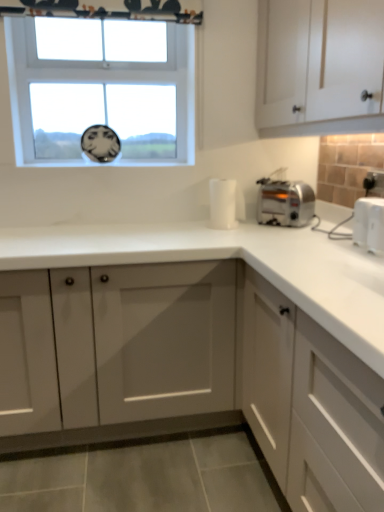
The width and height of the screenshot is (384, 512). I want to click on white plastic toaster at right, so click(x=369, y=224).

This screenshot has width=384, height=512. Describe the element at coordinates (285, 203) in the screenshot. I see `satin silver toaster at right` at that location.

How much space does white matte cabinet at upper right, marked as the 1th cabinetry in a top-to-bottom arrangement, occupy horizontally?

white matte cabinet at upper right, marked as the 1th cabinetry in a top-to-bottom arrangement, is 16.98 inches in width.

Where is `white matte cabinet at lower right, which is the 1th cabinetry from bottom to top`? This screenshot has height=512, width=384. white matte cabinet at lower right, which is the 1th cabinetry from bottom to top is located at coordinates (311, 406).

The height and width of the screenshot is (512, 384). What do you see at coordinates (101, 96) in the screenshot?
I see `clear glass window at upper center` at bounding box center [101, 96].

Find the location of a particular element. The image size is (384, 512). white plastic toaster at right is located at coordinates (369, 224).

At what (x,y) coordinates should I click in order to perform the action: click on appliance located underneath the clear glass window at upper center (from a real-world perspective). Please return your answer as a coordinate pair (x, y). Looking at the image, I should click on (369, 224).

Does point (382, 251) appear closer or farther from the camera than point (170, 115)?

Point (382, 251) is closer to the camera than point (170, 115).

From the image's perspective, is white plastic toaster at right above or below clear glass window at upper center?

white plastic toaster at right is below clear glass window at upper center.

Would you say clear glass window at upper center is part of white plastic toaster at right's contents?

That's incorrect, clear glass window at upper center is not inside white plastic toaster at right.

From a real-world perspective, count 1st cabinetrys upward from the white matte cabinet at lower right, the third cabinetry when ordered from top to bottom, and point to it. Please provide its 2D coordinates.

[(192, 370)]

From the image's perspective, which is below, white matte cabinet at center, which is the second cabinetry in bottom-to-top order, or white matte cabinet at lower right, the third cabinetry when ordered from top to bottom?

From the image's view, white matte cabinet at lower right, the third cabinetry when ordered from top to bottom, is below.

Would you consider white matte cabinet at center, which is the second cabinetry in bottom-to-top order, to be distant from white matte cabinet at lower right, the third cabinetry when ordered from top to bottom?

white matte cabinet at center, which is the second cabinetry in bottom-to-top order, is near white matte cabinet at lower right, the third cabinetry when ordered from top to bottom, not far away.

How different are the orientations of white matte cabinet at center, which is counted as the second cabinetry, starting from the top, and white matte cabinet at lower right, which is the 1th cabinetry from bottom to top, in degrees?

89.9 degrees separate the facing orientations of white matte cabinet at center, which is counted as the second cabinetry, starting from the top, and white matte cabinet at lower right, which is the 1th cabinetry from bottom to top.

What's the angular difference between clear glass window at upper center and white plastic toaster at right's facing directions?

88.6 degrees.

Considering the sizes of clear glass window at upper center and white plastic toaster at right in the image, is clear glass window at upper center taller or shorter than white plastic toaster at right?

Considering their sizes, clear glass window at upper center has more height than white plastic toaster at right.

Considering their positions, is clear glass window at upper center located in front of or behind white plastic toaster at right?

Visually, clear glass window at upper center is located behind white plastic toaster at right.

From the image's perspective, which is below, clear glass window at upper center or white plastic toaster at right?

white plastic toaster at right appears lower in the image.

In the image, is white matte cabinet at upper right, marked as the 1th cabinetry in a top-to-bottom arrangement, positioned in front of or behind white matte cabinet at center, which is the second cabinetry in bottom-to-top order?

In the image, white matte cabinet at upper right, marked as the 1th cabinetry in a top-to-bottom arrangement, appears in front of white matte cabinet at center, which is the second cabinetry in bottom-to-top order.

Image resolution: width=384 pixels, height=512 pixels. There is a white matte cabinet at upper right, the 3th cabinetry in the bottom-to-top sequence. In order to click on the 1st cabinetry below it (from the image's perspective) in this screenshot , I will do `click(192, 370)`.

From a real-world perspective, who is located lower, white matte cabinet at upper right, the 3th cabinetry in the bottom-to-top sequence, or white matte cabinet at center, which is counted as the second cabinetry, starting from the top?

white matte cabinet at center, which is counted as the second cabinetry, starting from the top, from a real-world perspective.

Which object is positioned more to the right, white matte cabinet at upper right, marked as the 1th cabinetry in a top-to-bottom arrangement, or white matte cabinet at center, which is counted as the second cabinetry, starting from the top?

Positioned to the right is white matte cabinet at upper right, marked as the 1th cabinetry in a top-to-bottom arrangement.

Does satin silver toaster at right turn towards white plastic toaster at right?

No, satin silver toaster at right is not turned towards white plastic toaster at right.

Looking at their sizes, would you say satin silver toaster at right is wider or thinner than white plastic toaster at right?

In the image, satin silver toaster at right appears to be more narrow than white plastic toaster at right.

Looking at the image, does satin silver toaster at right seem bigger or smaller compared to white plastic toaster at right?

Considering their sizes, satin silver toaster at right takes up more space than white plastic toaster at right.

From the picture: Can you see white plastic toaster at right touching white matte cabinet at upper right, marked as the 1th cabinetry in a top-to-bottom arrangement?

There is a gap between white plastic toaster at right and white matte cabinet at upper right, marked as the 1th cabinetry in a top-to-bottom arrangement.

From the image's perspective, would you say white plastic toaster at right is positioned over white matte cabinet at upper right, the 3th cabinetry in the bottom-to-top sequence?

No, from the image's perspective, white plastic toaster at right is not above white matte cabinet at upper right, the 3th cabinetry in the bottom-to-top sequence.

Would you say white plastic toaster at right contains white matte cabinet at upper right, marked as the 1th cabinetry in a top-to-bottom arrangement?

No, white plastic toaster at right does not contain white matte cabinet at upper right, marked as the 1th cabinetry in a top-to-bottom arrangement.

Considering the relative positions of clear glass window at upper center and white matte cabinet at upper right, marked as the 1th cabinetry in a top-to-bottom arrangement, in the image provided, is clear glass window at upper center in front of white matte cabinet at upper right, marked as the 1th cabinetry in a top-to-bottom arrangement,?

No, clear glass window at upper center is behind white matte cabinet at upper right, marked as the 1th cabinetry in a top-to-bottom arrangement.

Is clear glass window at upper center beside white matte cabinet at upper right, the 3th cabinetry in the bottom-to-top sequence?

clear glass window at upper center and white matte cabinet at upper right, the 3th cabinetry in the bottom-to-top sequence, are not in contact.

Can you confirm if clear glass window at upper center is wider than white matte cabinet at upper right, the 3th cabinetry in the bottom-to-top sequence?

In fact, clear glass window at upper center might be narrower than white matte cabinet at upper right, the 3th cabinetry in the bottom-to-top sequence.

Is point (46, 162) farther from camera compared to point (375, 114)?

Yes, point (46, 162) is behind point (375, 114).

Where is `appliance in front of the clear glass window at upper center`? This screenshot has width=384, height=512. appliance in front of the clear glass window at upper center is located at coordinates (369, 224).

At what (x,y) coordinates should I click in order to perform the action: click on cabinetry that is below the white matte cabinet at center, which is the second cabinetry in bottom-to-top order (from the image's perspective). Please return your answer as a coordinate pair (x, y). Image resolution: width=384 pixels, height=512 pixels. Looking at the image, I should click on (311, 406).

From the image, which object appears to be farther from white plastic toaster at right, white matte cabinet at lower right, the third cabinetry when ordered from top to bottom, or clear glass window at upper center?

clear glass window at upper center.

Looking at the image, which one is located closer to clear glass window at upper center, white plastic toaster at right or white matte cabinet at lower right, the third cabinetry when ordered from top to bottom?

The object closer to clear glass window at upper center is white matte cabinet at lower right, the third cabinetry when ordered from top to bottom.

Based on their spatial positions, is clear glass window at upper center or white matte cabinet at upper right, the 3th cabinetry in the bottom-to-top sequence, closer to white plastic toaster at right?

white matte cabinet at upper right, the 3th cabinetry in the bottom-to-top sequence, is positioned closer to the anchor white plastic toaster at right.

When comparing their distances from white plastic toaster at right, does white matte cabinet at upper right, marked as the 1th cabinetry in a top-to-bottom arrangement, or satin silver toaster at right seem further?

white matte cabinet at upper right, marked as the 1th cabinetry in a top-to-bottom arrangement, lies further to white plastic toaster at right than the other object.

Which object lies further to the anchor point white matte cabinet at center, which is counted as the second cabinetry, starting from the top, white matte cabinet at upper right, marked as the 1th cabinetry in a top-to-bottom arrangement, or white matte cabinet at lower right, the third cabinetry when ordered from top to bottom?

white matte cabinet at upper right, marked as the 1th cabinetry in a top-to-bottom arrangement, lies further to white matte cabinet at center, which is counted as the second cabinetry, starting from the top, than the other object.

From the picture: Estimate the real-world distances between objects in this image. Which object is closer to white matte cabinet at upper right, marked as the 1th cabinetry in a top-to-bottom arrangement, white matte cabinet at lower right, which is the 1th cabinetry from bottom to top, or satin silver toaster at right?

satin silver toaster at right is positioned closer to the anchor white matte cabinet at upper right, marked as the 1th cabinetry in a top-to-bottom arrangement.

Looking at the image, which one is located closer to white matte cabinet at lower right, which is the 1th cabinetry from bottom to top, white matte cabinet at upper right, marked as the 1th cabinetry in a top-to-bottom arrangement, or satin silver toaster at right?

satin silver toaster at right is closer to white matte cabinet at lower right, which is the 1th cabinetry from bottom to top.

When comparing their distances from white matte cabinet at lower right, the third cabinetry when ordered from top to bottom, does white matte cabinet at center, which is counted as the second cabinetry, starting from the top, or white matte cabinet at upper right, marked as the 1th cabinetry in a top-to-bottom arrangement, seem closer?

white matte cabinet at center, which is counted as the second cabinetry, starting from the top, lies closer to white matte cabinet at lower right, the third cabinetry when ordered from top to bottom, than the other object.

You are a GUI agent. You are given a task and a screenshot of the screen. Output one action in this format:
    pyautogui.click(x=<x>, y=<y>)
    Task: Click on the appliance between white matte cabinet at upper right, marked as the 1th cabinetry in a top-to-bottom arrangement, and white matte cabinet at center, which is counted as the second cabinetry, starting from the top, in the up-down direction
    Image resolution: width=384 pixels, height=512 pixels.
    Given the screenshot: What is the action you would take?
    pyautogui.click(x=369, y=224)

Where is `appliance positioned between white matte cabinet at upper right, marked as the 1th cabinetry in a top-to-bottom arrangement, and satin silver toaster at right from near to far`? appliance positioned between white matte cabinet at upper right, marked as the 1th cabinetry in a top-to-bottom arrangement, and satin silver toaster at right from near to far is located at coordinates (369, 224).

This screenshot has height=512, width=384. Identify the location of cabinetry that lies between clear glass window at upper center and white matte cabinet at center, which is counted as the second cabinetry, starting from the top, from top to bottom. (319, 66).

Where is `appliance between white matte cabinet at upper right, the 3th cabinetry in the bottom-to-top sequence, and white matte cabinet at lower right, which is the 1th cabinetry from bottom to top, from top to bottom`? This screenshot has height=512, width=384. appliance between white matte cabinet at upper right, the 3th cabinetry in the bottom-to-top sequence, and white matte cabinet at lower right, which is the 1th cabinetry from bottom to top, from top to bottom is located at coordinates click(369, 224).